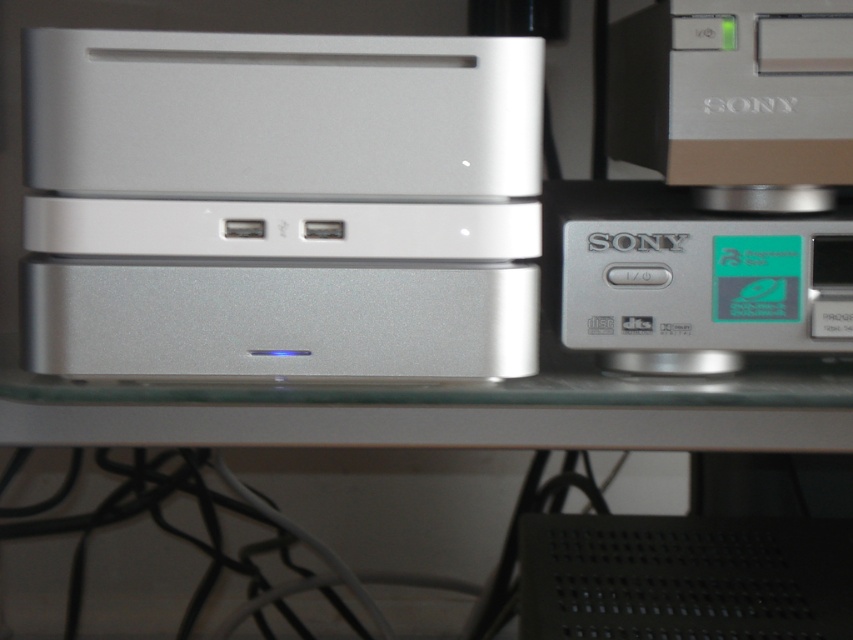
Question: Which of these objects is positioned closest to the satin silver computer at upper right?

Choices:
 (A) satin silver drive at center
 (B) satin silver speaker at center
 (C) silver metallic sony cd player at right

Answer: (C)

Question: Can you confirm if satin silver computer at center is positioned above satin silver computer at upper right?

Choices:
 (A) no
 (B) yes

Answer: (A)

Question: Which point is farther to the camera?

Choices:
 (A) satin silver computer at upper right
 (B) satin silver computer at center

Answer: (A)

Question: Is satin silver drive at center smaller than satin silver speaker at center?

Choices:
 (A) no
 (B) yes

Answer: (A)

Question: Does satin silver computer at center have a lesser width compared to satin silver drive at center?

Choices:
 (A) yes
 (B) no

Answer: (B)

Question: Which of these objects is positioned closest to the satin silver drive at center?

Choices:
 (A) satin silver speaker at center
 (B) silver metallic sony cd player at right
 (C) satin silver computer at center

Answer: (C)